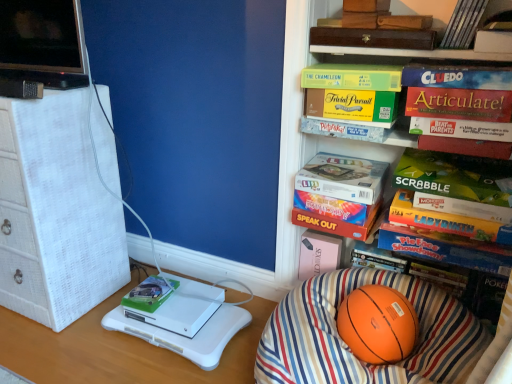
What do you see at coordinates (311, 135) in the screenshot?
I see `orange matte basketball at lower right` at bounding box center [311, 135].

How much space does red matte paperback book at upper right, which is the seventh paperback book from top to bottom, occupy vertically?

red matte paperback book at upper right, which is the seventh paperback book from top to bottom, is 1.79 inches tall.

I want to click on hardcover book at upper right, acting as the 1th book starting from the right, so click(463, 24).

This screenshot has height=384, width=512. What do you see at coordinates (55, 213) in the screenshot?
I see `white wicker drawer at left` at bounding box center [55, 213].

Find the location of a particular element. white matte xbox at lower left is located at coordinates (174, 304).

In order to click on green matte scrabble board game at center-right, the fifth paperback book from the bottom in this screenshot , I will do `click(457, 184)`.

From a real-world perspective, starting from the orange matte basketball at lower right, which paperback book is the 5th one vertically above it? Please provide its 2D coordinates.

[(459, 104)]

Considering the sizes of orange matte basketball at lower right and matte gold articulate! board game at upper right, positioned as the fifth paperback book in top-to-bottom order, in the image, is orange matte basketball at lower right wider or thinner than matte gold articulate! board game at upper right, positioned as the fifth paperback book in top-to-bottom order,?

In the image, orange matte basketball at lower right appears to be wider than matte gold articulate! board game at upper right, positioned as the fifth paperback book in top-to-bottom order.

From a real-world perspective, is orange matte basketball at lower right physically above matte gold articulate! board game at upper right, the 8th paperback book in the bottom-to-top sequence?

Actually, orange matte basketball at lower right is physically below matte gold articulate! board game at upper right, the 8th paperback book in the bottom-to-top sequence, in the real world.

Between orange matte basketball at lower right and matte gold articulate! board game at upper right, the 8th paperback book in the bottom-to-top sequence, which one is positioned behind?

matte gold articulate! board game at upper right, the 8th paperback book in the bottom-to-top sequence, is behind.

Does brown leather book at upper center, the twelfth paperback book in the bottom-to-top sequence, have a greater height compared to orange rubber basketball at lower center?

Incorrect, the height of brown leather book at upper center, the twelfth paperback book in the bottom-to-top sequence, is not larger of that of orange rubber basketball at lower center.

Between brown leather book at upper center, the twelfth paperback book in the bottom-to-top sequence, and orange rubber basketball at lower center, which one has larger size?

Bigger between the two is brown leather book at upper center, the twelfth paperback book in the bottom-to-top sequence.

Is brown leather book at upper center, the twelfth paperback book in the bottom-to-top sequence, behind orange rubber basketball at lower center?

Yes, it is.

Can you confirm if brown leather book at upper center, the twelfth paperback book in the bottom-to-top sequence, is positioned to the right of orange rubber basketball at lower center?

Correct, you'll find brown leather book at upper center, the twelfth paperback book in the bottom-to-top sequence, to the right of orange rubber basketball at lower center.

Considering the positions of point (179, 311) and point (473, 140), is point (179, 311) closer or farther from the camera than point (473, 140)?

Point (179, 311) is farther from the camera than point (473, 140).

From a real-world perspective, is white matte xbox at lower left positioned above or below red matte paperback book at upper right, which is the seventh paperback book from top to bottom?

Clearly, from a real-world perspective, white matte xbox at lower left is below red matte paperback book at upper right, which is the seventh paperback book from top to bottom.

Which of these two, white matte xbox at lower left or red matte paperback book at upper right, which is the seventh paperback book from top to bottom, is wider?

Wider between the two is white matte xbox at lower left.

Is white matte xbox at lower left smaller than red matte paperback book at upper right, marked as the sixth paperback book in a bottom-to-top arrangement?

No.

Can you confirm if yellow cardboard trivial pursuit game at upper center, acting as the 9th paperback book starting from the bottom, is smaller than green matte board game at upper center, which is the second paperback book from top to bottom?

Indeed, yellow cardboard trivial pursuit game at upper center, acting as the 9th paperback book starting from the bottom, has a smaller size compared to green matte board game at upper center, which is the second paperback book from top to bottom.

Is yellow cardboard trivial pursuit game at upper center, which appears as the 4th paperback book when viewed from the top, to the left of green matte board game at upper center, the eleventh paperback book from the bottom, from the viewer's perspective?

Yes, yellow cardboard trivial pursuit game at upper center, which appears as the 4th paperback book when viewed from the top, is to the left of green matte board game at upper center, the eleventh paperback book from the bottom.

How distant is yellow cardboard trivial pursuit game at upper center, which appears as the 4th paperback book when viewed from the top, from green matte board game at upper center, which is the second paperback book from top to bottom?

A distance of 1.89 inches exists between yellow cardboard trivial pursuit game at upper center, which appears as the 4th paperback book when viewed from the top, and green matte board game at upper center, which is the second paperback book from top to bottom.

Considering the sizes of objects yellow cardboard trivial pursuit game at upper center, acting as the 9th paperback book starting from the bottom, and green matte board game at upper center, the eleventh paperback book from the bottom, in the image provided, who is taller, yellow cardboard trivial pursuit game at upper center, acting as the 9th paperback book starting from the bottom, or green matte board game at upper center, the eleventh paperback book from the bottom,?

With more height is yellow cardboard trivial pursuit game at upper center, acting as the 9th paperback book starting from the bottom.

Considering the sizes of green matte board game at upper right, positioned as the third paperback book in bottom-to-top order, and hardcover book at upper right, which appears as the 6th paperback book when viewed from the top, in the image, is green matte board game at upper right, positioned as the third paperback book in bottom-to-top order, bigger or smaller than hardcover book at upper right, which appears as the 6th paperback book when viewed from the top,?

green matte board game at upper right, positioned as the third paperback book in bottom-to-top order, is bigger than hardcover book at upper right, which appears as the 6th paperback book when viewed from the top.

Which paperback book is the 3rd one when counting from the right side of the hardcover book at upper right, which is counted as the seventh paperback book, starting from the bottom? Please provide its 2D coordinates.

[(446, 221)]

Is green matte board game at upper right, positioned as the third paperback book in bottom-to-top order, facing away from hardcover book at upper right, which appears as the 6th paperback book when viewed from the top?

No, green matte board game at upper right, positioned as the third paperback book in bottom-to-top order, is not facing away from hardcover book at upper right, which appears as the 6th paperback book when viewed from the top.

Is blue cardboard cluedo board game at upper right, the third paperback book from the top, to the right of hardcover book at upper right, which ranks as the first book in top-to-bottom order, from the viewer's perspective?

Correct, you'll find blue cardboard cluedo board game at upper right, the third paperback book from the top, to the right of hardcover book at upper right, which ranks as the first book in top-to-bottom order.

Measure the distance from blue cardboard cluedo board game at upper right, the third paperback book from the top, to hardcover book at upper right, which ranks as the first book in top-to-bottom order.

A distance of 5.08 inches exists between blue cardboard cluedo board game at upper right, the third paperback book from the top, and hardcover book at upper right, which ranks as the first book in top-to-bottom order.

I want to click on the 4th paperback book to the right of the hardcover book at upper right, which ranks as the first book in top-to-bottom order, starting your count from the anchor, so point(457,76).

From the image's perspective, does blue cardboard cluedo board game at upper right, the third paperback book from the top, appear lower than hardcover book at upper right, which is the fourth book from bottom to top?

Yes, from the image's perspective, blue cardboard cluedo board game at upper right, the third paperback book from the top, is below hardcover book at upper right, which is the fourth book from bottom to top.

The image size is (512, 384). Find the location of `box below the mattel board game at center, the 2th book when ordered from bottom to top (from the image's perspective)`. box below the mattel board game at center, the 2th book when ordered from bottom to top (from the image's perspective) is located at coordinates [x=174, y=304].

Is white matte xbox at lower left further to camera compared to mattel board game at center, the third book when ordered from top to bottom?

Yes, white matte xbox at lower left is behind mattel board game at center, the third book when ordered from top to bottom.

Is point (184, 302) closer to camera compared to point (313, 181)?

No, it is not.

From the image's perspective, is white matte xbox at lower left under mattel board game at center, the third book positioned from the left?

Yes.

Find the bookcase that appears in front of the matte gold articulate! board game at upper right, the 8th paperback book in the bottom-to-top sequence. Please provide its 2D coordinates.

[(311, 135)]

Identify the location of the 11th paperback book located above the orange rubber basketball at lower center (from a real-world perspective). (373, 38).

Estimate the real-world distances between objects in this image. Which object is further from green matte scrabble board game at center-right, the fifth paperback book from the bottom, hardcover book at center, the twelfth paperback book positioned from the top, or yellow cardboard trivial pursuit game at upper center, which appears as the 4th paperback book when viewed from the top?

Among the two, hardcover book at center, the twelfth paperback book positioned from the top, is located further to green matte scrabble board game at center-right, the fifth paperback book from the bottom.

Considering their positions, is orange matte basketball at lower right positioned closer to blue cardboard cluedo board game at upper right, the third paperback book from the top, than hardcover book at upper right, which is the fourth book from bottom to top?

hardcover book at upper right, which is the fourth book from bottom to top, is positioned closer to the anchor blue cardboard cluedo board game at upper right, the third paperback book from the top.

Looking at the image, which one is located further to matte gold articulate! board game at upper right, the 8th paperback book in the bottom-to-top sequence, white matte xbox at lower left or multicolored cardboard game at right, which is the 2th paperback book in bottom-to-top order?

white matte xbox at lower left is positioned further to the anchor matte gold articulate! board game at upper right, the 8th paperback book in the bottom-to-top sequence.

Considering their positions, is white wicker drawer at left positioned closer to green matte book at lower left, which is the 1th book from bottom to top, than yellow cardboard trivial pursuit game at upper center, which appears as the 4th paperback book when viewed from the top?

white wicker drawer at left is positioned closer to the anchor green matte book at lower left, which is the 1th book from bottom to top.

Which object lies further to the anchor point orange matte basketball at lower right, green matte board game at upper center, the eleventh paperback book from the bottom, or green matte book at lower left, placed as the fourth book when sorted from top to bottom?

green matte book at lower left, placed as the fourth book when sorted from top to bottom, lies further to orange matte basketball at lower right than the other object.

Looking at the image, which one is located further to green matte book at lower left, placed as the fourth book when sorted from top to bottom, orange fabric bean bag chair at lower right or white matte xbox at lower left?

orange fabric bean bag chair at lower right is positioned further to the anchor green matte book at lower left, placed as the fourth book when sorted from top to bottom.

Looking at the image, which one is located closer to white matte xbox at lower left, green matte board game at upper right, the 10th paperback book positioned from the top, or green matte scrabble board game at center-right, the fifth paperback book from the bottom?

The object closer to white matte xbox at lower left is green matte board game at upper right, the 10th paperback book positioned from the top.

Considering their positions, is white wicker drawer at left positioned closer to matte cardboard pictionary at upper center, which is counted as the 3th book, starting from the right, than orange rubber basketball at lower center?

The object closer to matte cardboard pictionary at upper center, which is counted as the 3th book, starting from the right, is orange rubber basketball at lower center.

Image resolution: width=512 pixels, height=384 pixels. Find the location of `box situated between white wicker drawer at left and yellow cardboard trivial pursuit game at upper center, acting as the 9th paperback book starting from the bottom, from left to right`. box situated between white wicker drawer at left and yellow cardboard trivial pursuit game at upper center, acting as the 9th paperback book starting from the bottom, from left to right is located at coordinates (174, 304).

The height and width of the screenshot is (384, 512). In order to click on bookcase between blue cardboard cluedo board game at upper right, the third paperback book from the top, and green matte scrabble board game at center-right, which appears as the eighth paperback book when viewed from the top, from top to bottom in this screenshot , I will do `click(311, 135)`.

Where is `bookcase between hardcover book at upper right, which ranks as the first book in top-to-bottom order, and green matte scrabble board game at center-right, the fifth paperback book from the bottom, from top to bottom`? Image resolution: width=512 pixels, height=384 pixels. bookcase between hardcover book at upper right, which ranks as the first book in top-to-bottom order, and green matte scrabble board game at center-right, the fifth paperback book from the bottom, from top to bottom is located at coordinates (x=311, y=135).

This screenshot has width=512, height=384. I want to click on ball between green matte book at lower left, placed as the fourth book when sorted from top to bottom, and hardcover book at upper right, the fourth book from the left, in the horizontal direction, so click(378, 324).